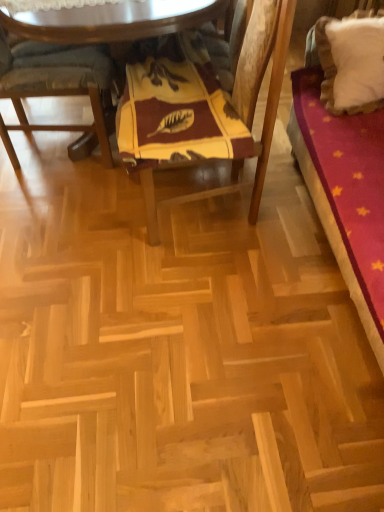
Question: Considering the relative sizes of velvet red bed at right and natural wood parquet floor at center in the image provided, is velvet red bed at right shorter than natural wood parquet floor at center?

Choices:
 (A) yes
 (B) no

Answer: (B)

Question: Is velvet red bed at right far from natural wood parquet floor at center?

Choices:
 (A) yes
 (B) no

Answer: (B)

Question: Can you see velvet red bed at right touching natural wood parquet floor at center?

Choices:
 (A) no
 (B) yes

Answer: (A)

Question: Does velvet red bed at right have a smaller size compared to natural wood parquet floor at center?

Choices:
 (A) no
 (B) yes

Answer: (A)

Question: From the image's perspective, is velvet red bed at right over natural wood parquet floor at center?

Choices:
 (A) yes
 (B) no

Answer: (B)

Question: Does velvet red bed at right have a greater height compared to natural wood parquet floor at center?

Choices:
 (A) no
 (B) yes

Answer: (B)

Question: From a real-world perspective, is wooden table at center physically above wooden cushioned chair at left, the 2th chair viewed from the right?

Choices:
 (A) no
 (B) yes

Answer: (B)

Question: Considering the relative sizes of wooden table at center and wooden cushioned chair at left, the 2th chair viewed from the right, in the image provided, is wooden table at center thinner than wooden cushioned chair at left, the 2th chair viewed from the right,?

Choices:
 (A) no
 (B) yes

Answer: (A)

Question: From the image's perspective, does wooden table at center appear higher than wooden cushioned chair at left, the 2th chair viewed from the right?

Choices:
 (A) no
 (B) yes

Answer: (B)

Question: Would you consider wooden table at center to be distant from wooden cushioned chair at left, the 1th chair positioned from the left?

Choices:
 (A) no
 (B) yes

Answer: (A)

Question: Considering the relative sizes of wooden table at center and wooden cushioned chair at left, the 2th chair viewed from the right, in the image provided, is wooden table at center smaller than wooden cushioned chair at left, the 2th chair viewed from the right,?

Choices:
 (A) no
 (B) yes

Answer: (A)

Question: Would you say wooden cushioned chair at left, the 2th chair viewed from the right, is part of wooden table at center's contents?

Choices:
 (A) yes
 (B) no

Answer: (A)

Question: Is yellow fabric cushion at center, acting as the second chair starting from the left, touching white fluffy pillow at upper right?

Choices:
 (A) yes
 (B) no

Answer: (B)